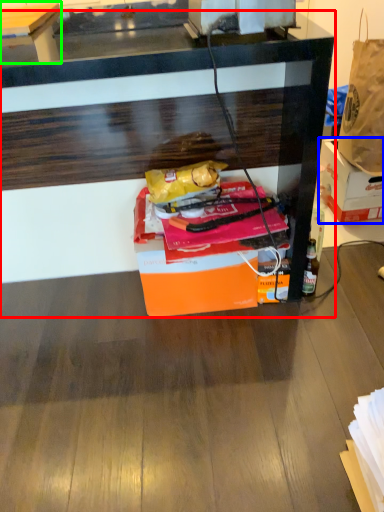
Question: Based on their relative distances, which object is nearer to desk (highlighted by a red box)? Choose from box (highlighted by a blue box) and table (highlighted by a green box).

Choices:
 (A) box
 (B) table

Answer: (A)